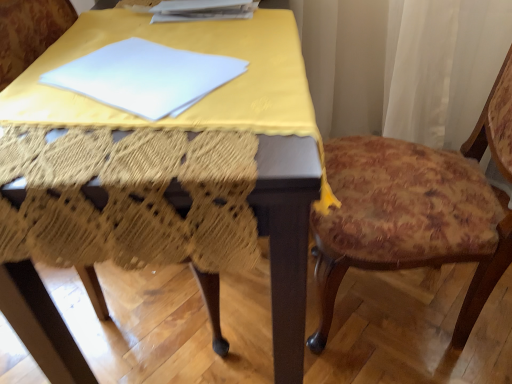
Identify the location of free space underneath floral fabric cushion at right (from a real-world perspective). point(390,307).